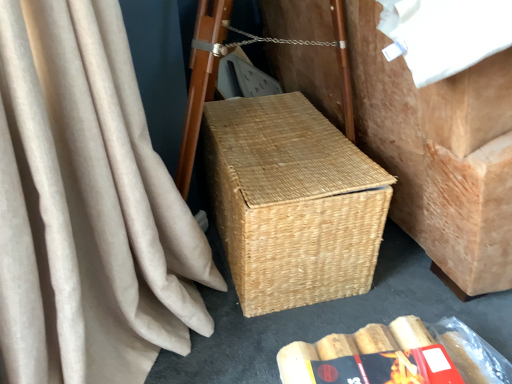
Question: Considering the positions of point (407, 382) and point (342, 382), is point (407, 382) closer or farther from the camera than point (342, 382)?

Choices:
 (A) closer
 (B) farther

Answer: (B)

Question: From the image's perspective, is red matte paperback book at lower center located above or below woven brown basket at center?

Choices:
 (A) below
 (B) above

Answer: (B)

Question: Estimate the real-world distances between objects in this image. Which object is farther from the red matte paperback book at lower center?

Choices:
 (A) natural woven picnic basket at center
 (B) natural woven basket at center
 (C) woven brown basket at center

Answer: (B)

Question: Based on their relative distances, which object is farther from the natural woven picnic basket at center?

Choices:
 (A) woven brown basket at center
 (B) natural woven basket at center
 (C) red matte paperback book at lower center

Answer: (C)